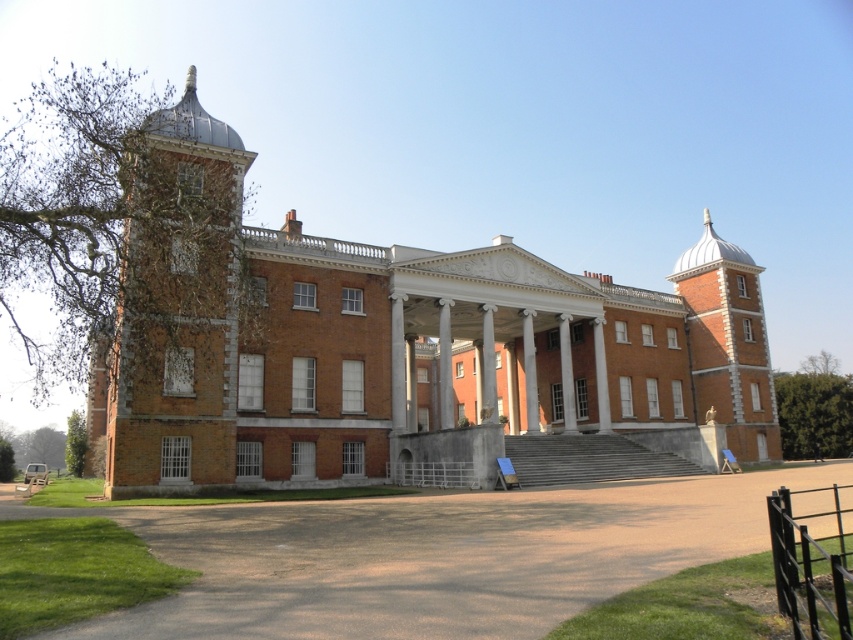
Question: Which point is closer to the camera?

Choices:
 (A) brown gravel driveway at lower center
 (B) brick stonework bell tower at right
 (C) white marble pillar at center

Answer: (A)

Question: Does brick stonework bell tower at left come in front of brick stonework bell tower at right?

Choices:
 (A) no
 (B) yes

Answer: (B)

Question: Is brown gravel driveway at lower center thinner than brick stonework bell tower at left?

Choices:
 (A) no
 (B) yes

Answer: (A)

Question: Which point is farther to the camera?

Choices:
 (A) (708, 548)
 (B) (566, 413)
 (C) (711, 323)
 (D) (213, 214)

Answer: (C)

Question: Among these objects, which one is farthest from the camera?

Choices:
 (A) brown gravel driveway at lower center
 (B) white marble pillar at center

Answer: (B)

Question: Can you confirm if brick stonework bell tower at left is positioned above brick stonework bell tower at right?

Choices:
 (A) no
 (B) yes

Answer: (A)